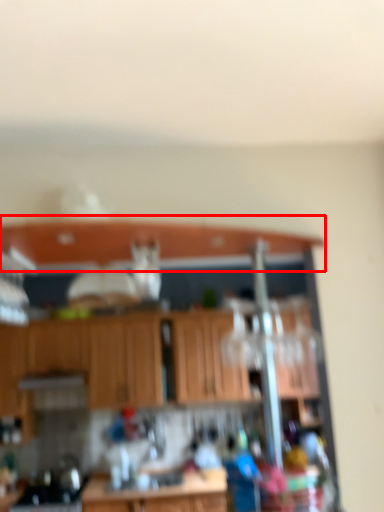
Question: In this image, where is window sill (annotated by the red box) located relative to cabinetry?

Choices:
 (A) left
 (B) right

Answer: (B)